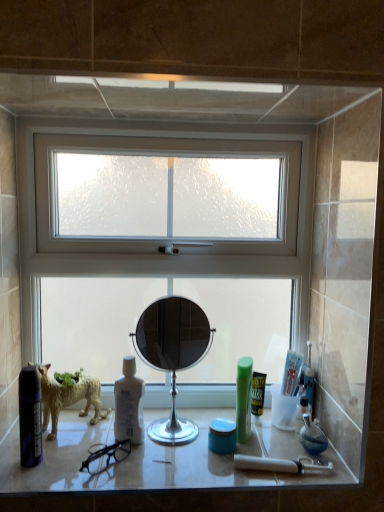
Identify the location of silver/metallic mirror at center. The height and width of the screenshot is (512, 384). (172, 354).

What is the approximate width of silver/metallic mirror at center?

12.36 centimeters.

Describe the element at coordinates (129, 404) in the screenshot. The image size is (384, 512). I see `white glossy mouthwash at center, which ranks as the third mouthwash in right-to-left order` at that location.

The width and height of the screenshot is (384, 512). Describe the element at coordinates (243, 398) in the screenshot. I see `green plastic bottle at center-right` at that location.

Identify the location of green plastic bottle at center-right. Image resolution: width=384 pixels, height=512 pixels. (243, 398).

Locate an element on the screen. green plastic mouthwash at right, the 1th mouthwash in the right-to-left sequence is located at coordinates (258, 396).

Is matte black can at left spatially inside blue matte jar at center, the second mouthwash positioned from the left, or outside of it?

matte black can at left cannot be found inside blue matte jar at center, the second mouthwash positioned from the left.

How distant is matte black can at left from blue matte jar at center, arranged as the second mouthwash when viewed from the right?

matte black can at left is 44.34 centimeters away from blue matte jar at center, arranged as the second mouthwash when viewed from the right.

Is matte black can at left thinner than blue matte jar at center, the second mouthwash positioned from the left?

Yes.

Which of these two, white glossy mouthwash at center, which ranks as the third mouthwash in right-to-left order, or silver/metallic mirror at center, is bigger?

silver/metallic mirror at center is bigger.

Is white glossy mouthwash at center, the 1th mouthwash viewed from the left, not within silver/metallic mirror at center?

That's incorrect, white glossy mouthwash at center, the 1th mouthwash viewed from the left, is not completely outside silver/metallic mirror at center.

Where is `mirror above the white glossy mouthwash at center, the 1th mouthwash viewed from the left (from a real-world perspective)`? This screenshot has height=512, width=384. mirror above the white glossy mouthwash at center, the 1th mouthwash viewed from the left (from a real-world perspective) is located at coordinates (172, 354).

From a real-world perspective, between white glossy mouthwash at center, the 1th mouthwash viewed from the left, and silver/metallic mirror at center, who is vertically lower?

From a 3D spatial view, white glossy mouthwash at center, the 1th mouthwash viewed from the left, is below.

Can you confirm if white frosted glass window at center is positioned to the left of blue matte jar at center, arranged as the second mouthwash when viewed from the right?

Correct, you'll find white frosted glass window at center to the left of blue matte jar at center, arranged as the second mouthwash when viewed from the right.

In terms of height, does white frosted glass window at center look taller or shorter compared to blue matte jar at center, the second mouthwash positioned from the left?

white frosted glass window at center is taller than blue matte jar at center, the second mouthwash positioned from the left.

Locate an element on the screen. The image size is (384, 512). window located above the blue matte jar at center, the second mouthwash positioned from the left (from the image's perspective) is located at coordinates (163, 240).

How distant is white glossy mouthwash at center, the 1th mouthwash viewed from the left, from speckled ceramic figurine at lower left?

6.14 inches.

The image size is (384, 512). In order to click on the 1st mouthwash to the right of the speckled ceramic figurine at lower left, starting your count from the anchor in this screenshot , I will do `click(129, 404)`.

Between white glossy mouthwash at center, the 1th mouthwash viewed from the left, and speckled ceramic figurine at lower left, which one has smaller width?

white glossy mouthwash at center, the 1th mouthwash viewed from the left.

Based on their sizes in the image, would you say speckled ceramic figurine at lower left is bigger or smaller than silver/metallic mirror at center?

speckled ceramic figurine at lower left is smaller than silver/metallic mirror at center.

Based on the photo, is speckled ceramic figurine at lower left spatially inside silver/metallic mirror at center, or outside of it?

speckled ceramic figurine at lower left is outside silver/metallic mirror at center.

Which is more to the right, matte black can at left or silver/metallic mirror at center?

silver/metallic mirror at center.

Find the location of a particular element. mirror that appears behind the matte black can at left is located at coordinates (172, 354).

Consider the image. Is silver/metallic mirror at center inside matte black can at left?

That's incorrect, silver/metallic mirror at center is not inside matte black can at left.

Can you confirm if matte black can at left is smaller than silver/metallic mirror at center?

Indeed, matte black can at left has a smaller size compared to silver/metallic mirror at center.

Relative to green plastic mouthwash at right, the 3th mouthwash positioned from the left, is speckled ceramic figurine at lower left in front or behind?

speckled ceramic figurine at lower left is in front of green plastic mouthwash at right, the 3th mouthwash positioned from the left.

Is speckled ceramic figurine at lower left with green plastic mouthwash at right, the 1th mouthwash in the right-to-left sequence?

No, speckled ceramic figurine at lower left is not next to green plastic mouthwash at right, the 1th mouthwash in the right-to-left sequence.

Which is behind, point (72, 392) or point (255, 400)?

Positioned behind is point (255, 400).

Who is smaller, speckled ceramic figurine at lower left or green plastic mouthwash at right, the 3th mouthwash positioned from the left?

green plastic mouthwash at right, the 3th mouthwash positioned from the left, is smaller.

At what (x,y) coordinates should I click in order to perform the action: click on mouthwash that is the 3rd one below the matte black can at left (from a real-world perspective). Please return your answer as a coordinate pair (x, y). Looking at the image, I should click on (222, 436).

Identify the location of mirror above the white glossy mouthwash at center, the 1th mouthwash viewed from the left (from the image's perspective). Image resolution: width=384 pixels, height=512 pixels. (172, 354).

From the image, which object appears to be nearer to white glossy mouthwash at center, the 1th mouthwash viewed from the left, green plastic bottle at center-right or matte black can at left?

Based on the image, matte black can at left appears to be nearer to white glossy mouthwash at center, the 1th mouthwash viewed from the left.

Estimate the real-world distances between objects in this image. Which object is further from white glossy mouthwash at center, which ranks as the third mouthwash in right-to-left order, speckled ceramic figurine at lower left or silver/metallic mirror at center?

speckled ceramic figurine at lower left lies further to white glossy mouthwash at center, which ranks as the third mouthwash in right-to-left order, than the other object.

Based on their spatial positions, is green plastic bottle at center-right or white glossy mouthwash at center, which ranks as the third mouthwash in right-to-left order, closer to blue matte jar at center, arranged as the second mouthwash when viewed from the right?

The object closer to blue matte jar at center, arranged as the second mouthwash when viewed from the right, is green plastic bottle at center-right.

From the image, which object appears to be farther from green plastic bottle at center-right, white glossy mouthwash at center, which ranks as the third mouthwash in right-to-left order, or speckled ceramic figurine at lower left?

speckled ceramic figurine at lower left lies further to green plastic bottle at center-right than the other object.

Looking at the image, which one is located closer to matte black can at left, blue matte jar at center, arranged as the second mouthwash when viewed from the right, or green plastic bottle at center-right?

Among the two, blue matte jar at center, arranged as the second mouthwash when viewed from the right, is located nearer to matte black can at left.

Looking at the image, which one is located closer to white frosted glass window at center, white glossy countertop at center or blue matte jar at center, arranged as the second mouthwash when viewed from the right?

white glossy countertop at center is positioned closer to the anchor white frosted glass window at center.

Estimate the real-world distances between objects in this image. Which object is further from blue matte jar at center, arranged as the second mouthwash when viewed from the right, green plastic bottle at center-right or matte black can at left?

matte black can at left is further to blue matte jar at center, arranged as the second mouthwash when viewed from the right.

Considering their positions, is blue matte jar at center, the second mouthwash positioned from the left, positioned closer to green plastic bottle at center-right than white glossy mouthwash at center, the 1th mouthwash viewed from the left?

blue matte jar at center, the second mouthwash positioned from the left, is closer to green plastic bottle at center-right.

Where is `mirror that lies between white frosted glass window at center and white glossy mouthwash at center, the 1th mouthwash viewed from the left, from top to bottom`? This screenshot has height=512, width=384. mirror that lies between white frosted glass window at center and white glossy mouthwash at center, the 1th mouthwash viewed from the left, from top to bottom is located at coordinates (172, 354).

Locate an element on the screen. dog between matte black can at left and white glossy countertop at center in the horizontal direction is located at coordinates (68, 398).

Locate an element on the screen. The width and height of the screenshot is (384, 512). window situated between matte black can at left and silver/metallic mirror at center from left to right is located at coordinates (163, 240).

What are the coordinates of `mirror located between matte black can at left and green plastic bottle at center-right in the left-right direction` in the screenshot? It's located at (172, 354).